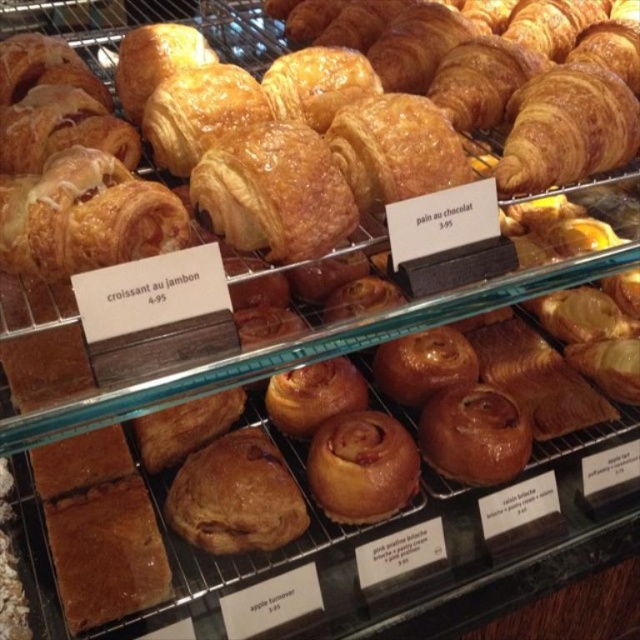
Question: Can you confirm if golden brown doughnut at center is positioned to the right of golden brown flaky croissant at upper center?

Choices:
 (A) no
 (B) yes

Answer: (A)

Question: Can you confirm if golden brown doughnut at center is positioned to the right of golden brown flaky croissant at upper center?

Choices:
 (A) yes
 (B) no

Answer: (B)

Question: Is golden brown doughnut at center to the right of golden brown flaky croissant at upper center from the viewer's perspective?

Choices:
 (A) yes
 (B) no

Answer: (B)

Question: Among these points, which one is nearest to the camera?

Choices:
 (A) (180, 129)
 (B) (228, 499)
 (C) (323, 467)

Answer: (A)

Question: Which of the following is the farthest from the observer?

Choices:
 (A) (374, 518)
 (B) (205, 113)
 (C) (278, 524)

Answer: (A)

Question: Which object is closer to the camera taking this photo?

Choices:
 (A) golden brown flaky croissant at upper center
 (B) golden brown flaky pastry at center
 (C) golden brown doughnut at center

Answer: (A)